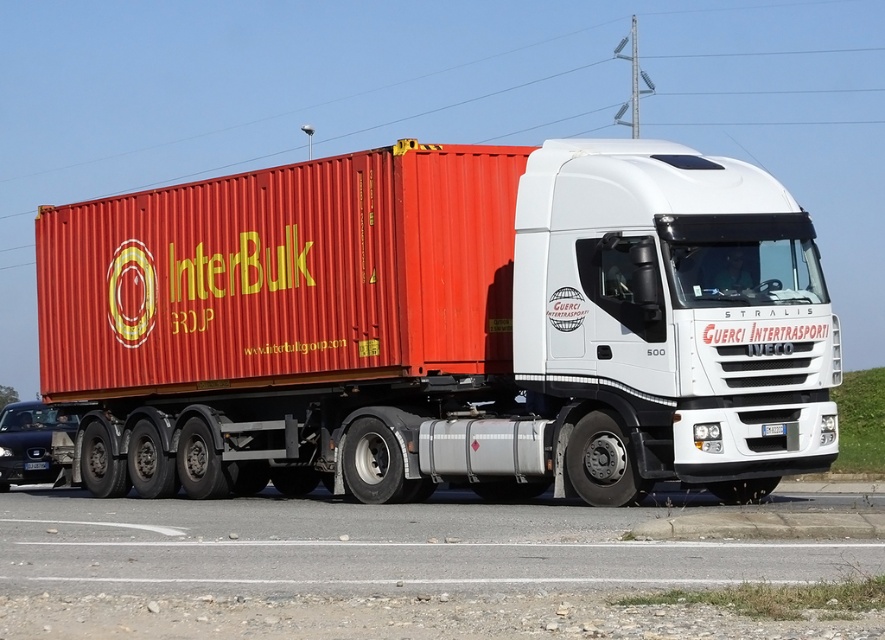
Question: Does metallic red container at center appear on the left side of metallic blue sedan at lower left?

Choices:
 (A) no
 (B) yes

Answer: (A)

Question: Can you confirm if metallic red container at center is positioned below metallic red shipping container at center?

Choices:
 (A) no
 (B) yes

Answer: (B)

Question: Which of these objects is positioned farthest from the black plastic license plate at center?

Choices:
 (A) metallic red shipping container at center
 (B) white plastic license plate at center

Answer: (B)

Question: Among these points, which one is nearest to the camera?

Choices:
 (A) (99, 220)
 (B) (36, 460)
 (C) (764, 433)

Answer: (C)

Question: Considering the relative positions of metallic red container at center and metallic blue sedan at lower left in the image provided, where is metallic red container at center located with respect to metallic blue sedan at lower left?

Choices:
 (A) above
 (B) below

Answer: (A)

Question: Which of these objects is positioned closest to the metallic red container at center?

Choices:
 (A) black plastic license plate at center
 (B) metallic red shipping container at center
 (C) metallic blue sedan at lower left
 (D) white plastic license plate at center

Answer: (B)